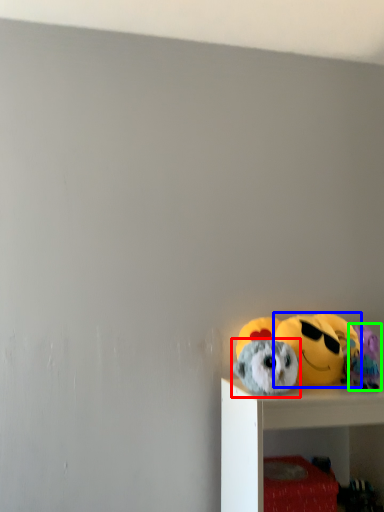
Question: Considering the real-world distances, which object is closest to toy (highlighted by a red box)? toy (highlighted by a blue box) or toy (highlighted by a green box).

Choices:
 (A) toy
 (B) toy

Answer: (A)